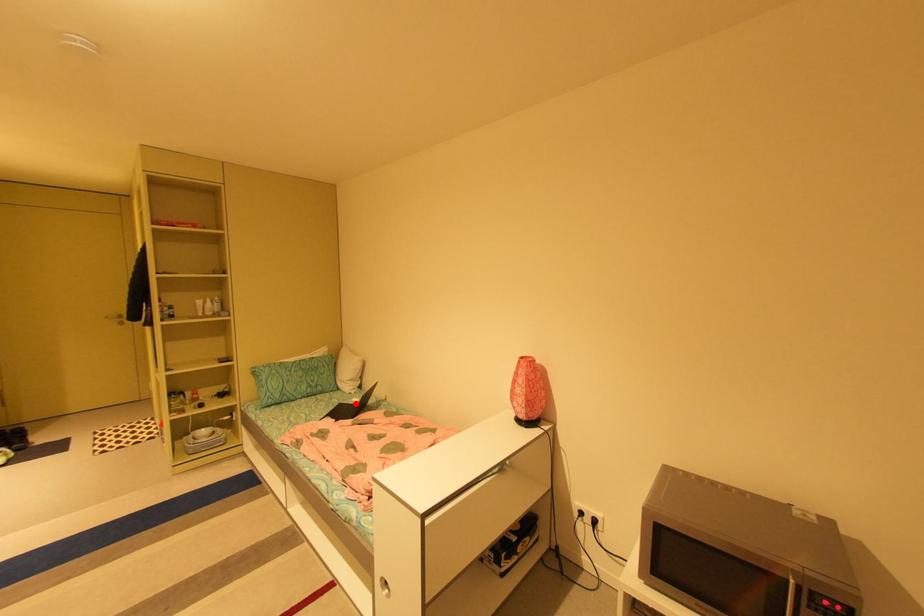
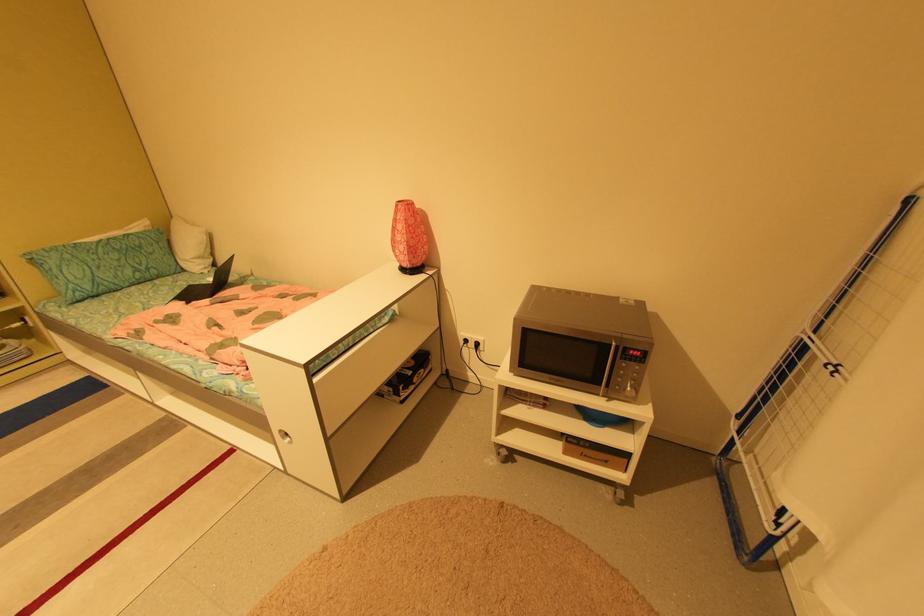
The point at the highlighted location is marked in the first image. Where is the corresponding point in the second image?

(210, 284)